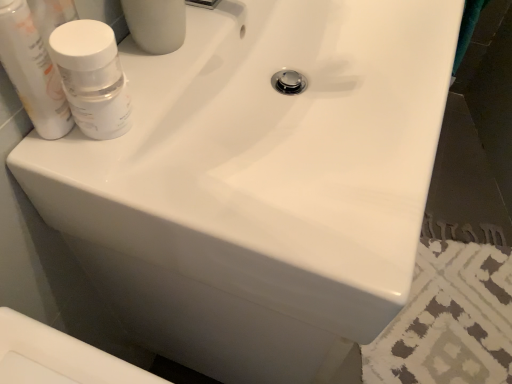
The width and height of the screenshot is (512, 384). In order to click on free spot to the right of white glossy bottle at upper left, the 2th mouthwash from the right in this screenshot , I will do `click(148, 145)`.